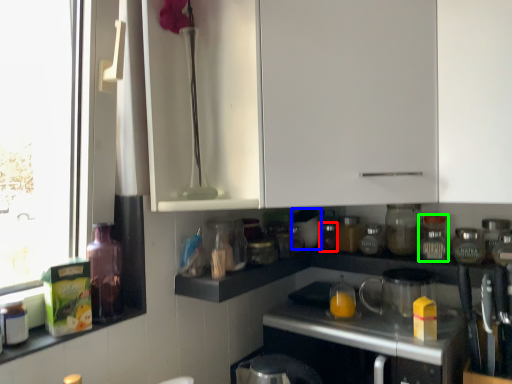
Question: Which object is the closest to the bottle (highlighted by a red box)? Choose among these: appliance (highlighted by a blue box) or bottle (highlighted by a green box).

Choices:
 (A) appliance
 (B) bottle

Answer: (A)